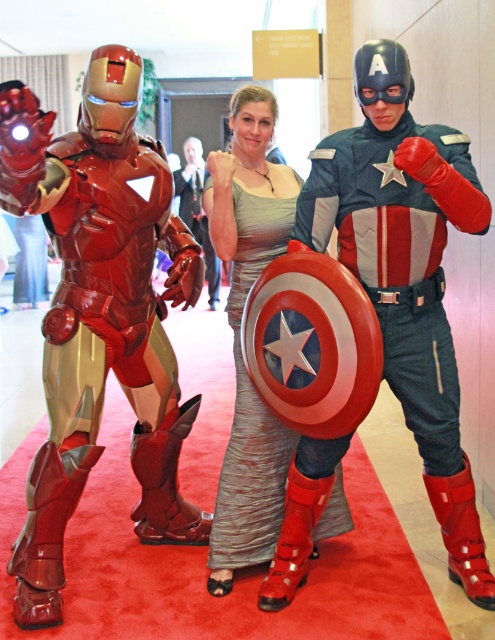
Question: Does shiny metallic armor at left appear on the right side of shiny metallic armor at center?

Choices:
 (A) yes
 (B) no

Answer: (A)

Question: Does shiny metallic shield at center have a lesser width compared to shiny silver dress at center?

Choices:
 (A) no
 (B) yes

Answer: (A)

Question: Which object is positioned closest to the shiny silver dress at center?

Choices:
 (A) shiny metallic armor at center
 (B) shiny metallic shield at center
 (C) shiny metallic armor at left

Answer: (C)

Question: Can you confirm if shiny metallic shield at center is thinner than shiny metallic armor at center?

Choices:
 (A) yes
 (B) no

Answer: (B)

Question: Based on their relative distances, which object is farther from the shiny metallic armor at left?

Choices:
 (A) shiny metallic armor at center
 (B) shiny silver dress at center
 (C) shiny metallic shield at center

Answer: (A)

Question: Which object is the closest to the shiny metallic armor at left?

Choices:
 (A) shiny metallic shield at center
 (B) shiny silver dress at center
 (C) shiny metallic armor at center

Answer: (B)